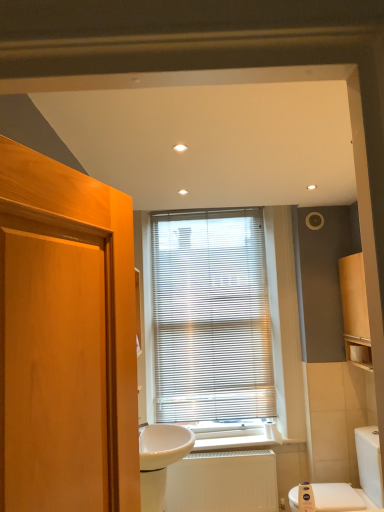
Question: Does white glossy sink at center have a lesser width compared to white glossy toilet at lower right?

Choices:
 (A) yes
 (B) no

Answer: (A)

Question: From a real-world perspective, is white glossy sink at center physically below white glossy toilet at lower right?

Choices:
 (A) no
 (B) yes

Answer: (A)

Question: Would you consider white glossy sink at center to be distant from white glossy toilet at lower right?

Choices:
 (A) no
 (B) yes

Answer: (B)

Question: Does white glossy sink at center come in front of white glossy toilet at lower right?

Choices:
 (A) yes
 (B) no

Answer: (A)

Question: Does white glossy sink at center contain white glossy toilet at lower right?

Choices:
 (A) yes
 (B) no

Answer: (B)

Question: Does white glossy sink at center have a larger size compared to white glossy toilet at lower right?

Choices:
 (A) no
 (B) yes

Answer: (A)

Question: Does white matte toilet paper at right appear on the right side of white textured radiator at lower center?

Choices:
 (A) yes
 (B) no

Answer: (A)

Question: From a real-world perspective, is white matte toilet paper at right positioned under white textured radiator at lower center based on gravity?

Choices:
 (A) yes
 (B) no

Answer: (B)

Question: Is white matte toilet paper at right taller than white textured radiator at lower center?

Choices:
 (A) yes
 (B) no

Answer: (B)

Question: Is the position of white matte toilet paper at right less distant than that of white textured radiator at lower center?

Choices:
 (A) no
 (B) yes

Answer: (B)

Question: Is white matte toilet paper at right smaller than white textured radiator at lower center?

Choices:
 (A) yes
 (B) no

Answer: (A)

Question: Is white matte toilet paper at right with white textured radiator at lower center?

Choices:
 (A) yes
 (B) no

Answer: (B)

Question: Is white matte toilet paper at right aimed at white glossy toilet at lower right?

Choices:
 (A) yes
 (B) no

Answer: (B)